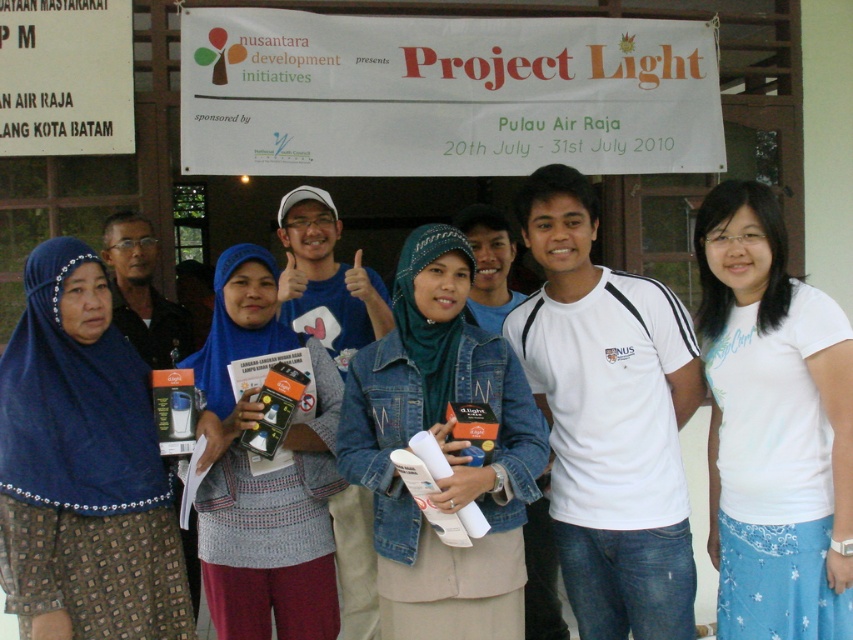
Question: Can you confirm if white cotton t-shirt at center is positioned above denim jacket at center?

Choices:
 (A) yes
 (B) no

Answer: (A)

Question: Which point appears farthest from the camera in this image?

Choices:
 (A) (447, 442)
 (B) (322, 508)
 (C) (45, 483)
 (D) (850, 472)

Answer: (B)

Question: Does white cotton t-shirt at center have a greater width compared to blue fabric hijab at center?

Choices:
 (A) yes
 (B) no

Answer: (B)

Question: Which of the following is the closest to the observer?

Choices:
 (A) (428, 307)
 (B) (138, 500)
 (C) (766, 445)

Answer: (B)

Question: Which point is closer to the camera?

Choices:
 (A) (202, 456)
 (B) (445, 356)
 (C) (764, 461)

Answer: (C)

Question: Is white cotton t-shirt at center to the right of blue fabric hijab at center from the viewer's perspective?

Choices:
 (A) yes
 (B) no

Answer: (A)